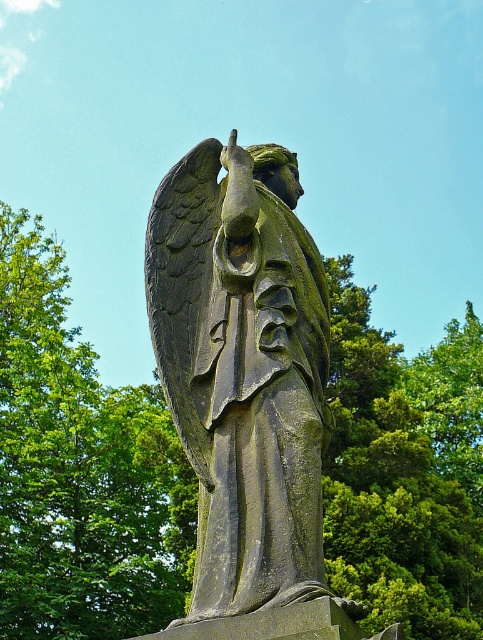
You are standing at the origin point in the image. You want to walk to the green leafy tree at center. What direction should you walk in?

The green leafy tree at center is located at point 0.734 on the x axis and 0.168 on the y axis. Since you are at the origin point, you should walk towards the northeast direction to reach the green leafy tree at center.

You are standing in front of the statue of an angel. There is a point marked at coordinates (81, 468). What is located at that point?

The point at coordinates (81, 468) marks a green leafy tree at center.

You are an art conservator assessing the placement of the greenish stone statue at center and the green leafy tree at center in the image. Considering the statue is weathered due to exposure, which object is more likely to be blocking sunlight from reaching the other?

The green leafy tree at center is in front of the greenish stone statue at center, so it is blocking sunlight from reaching the statue.